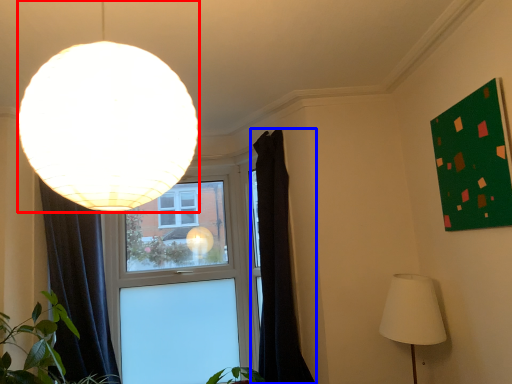
Question: Which of the following is the farthest to the observer, lamp (highlighted by a red box) or curtain (highlighted by a blue box)?

Choices:
 (A) lamp
 (B) curtain

Answer: (B)